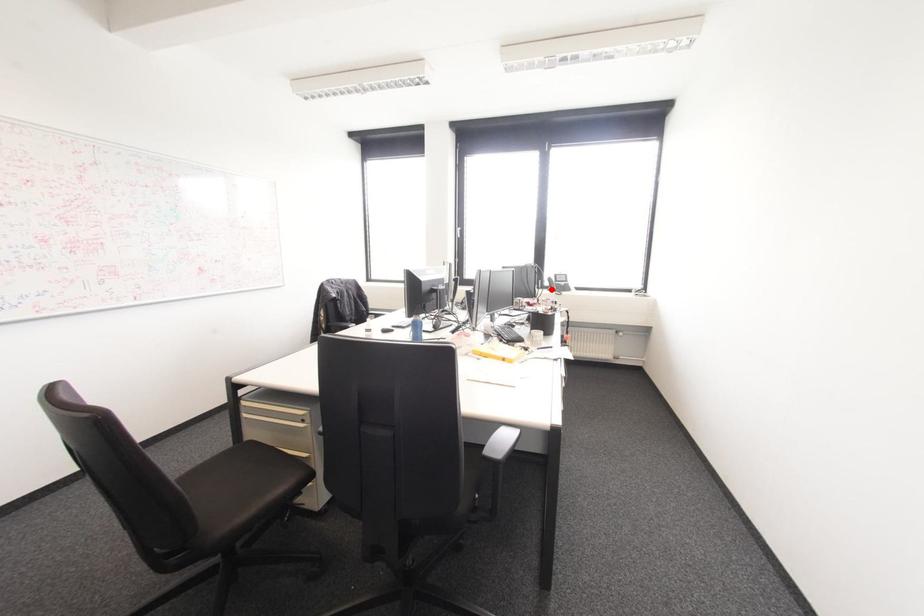
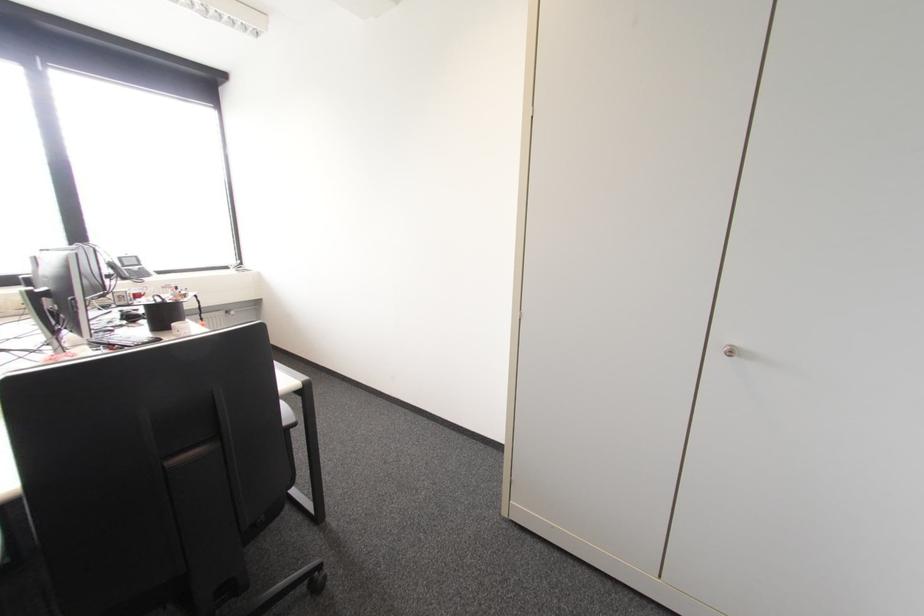
In the second image, find the point that corresponds to the highlighted location in the first image.

(123, 278)